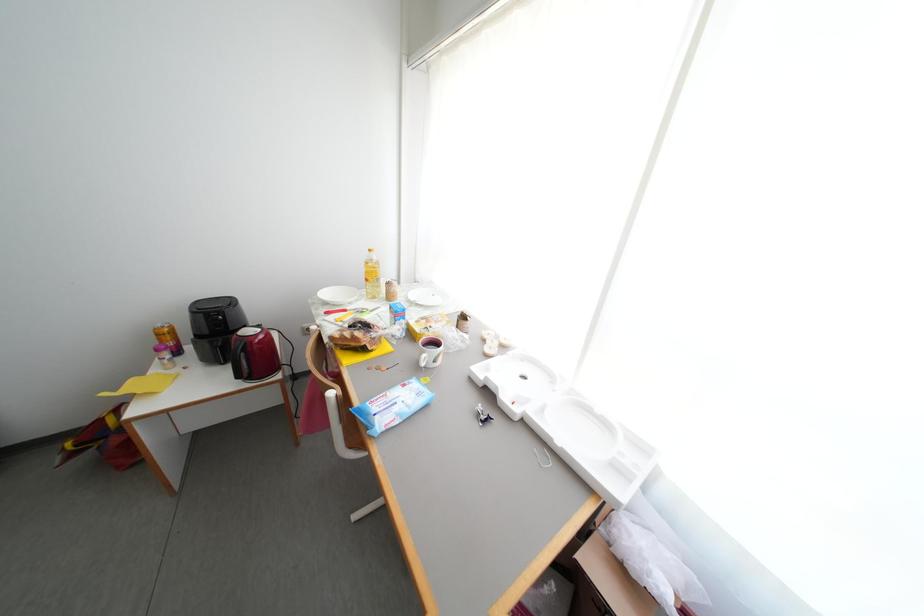
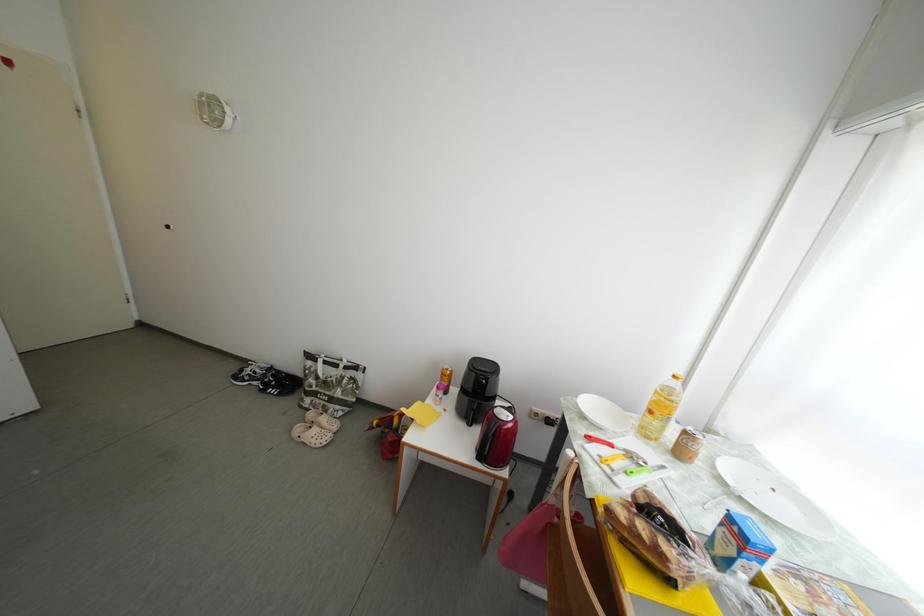
Question: The camera is either moving clockwise (left) or counter-clockwise (right) around the object. The first image is from the beginning of the video and the second image is from the end. Is the camera moving left or right when shooting the video?

Choices:
 (A) Left
 (B) Right

Answer: (B)